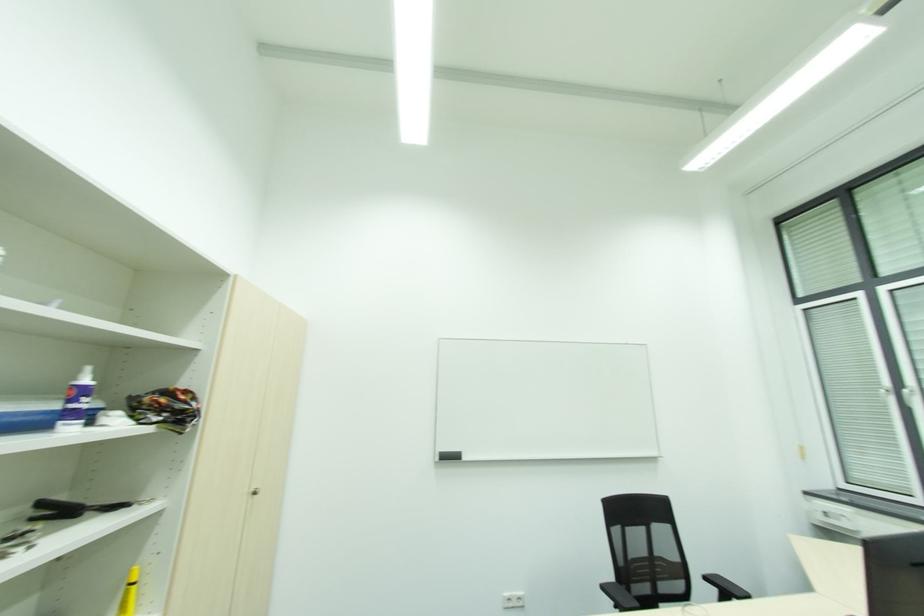
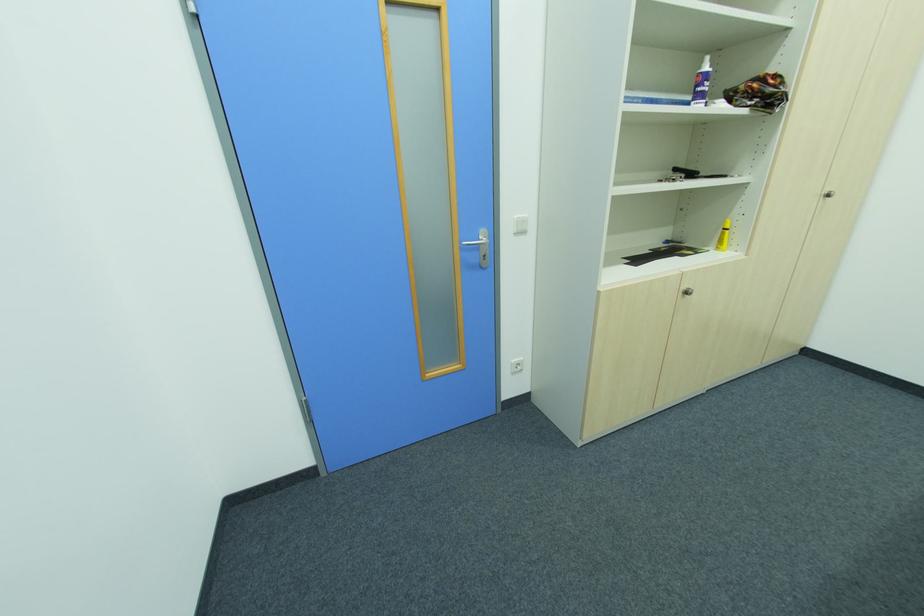
Where in the second image is the point corresponding to (253,496) from the first image?

(822, 198)